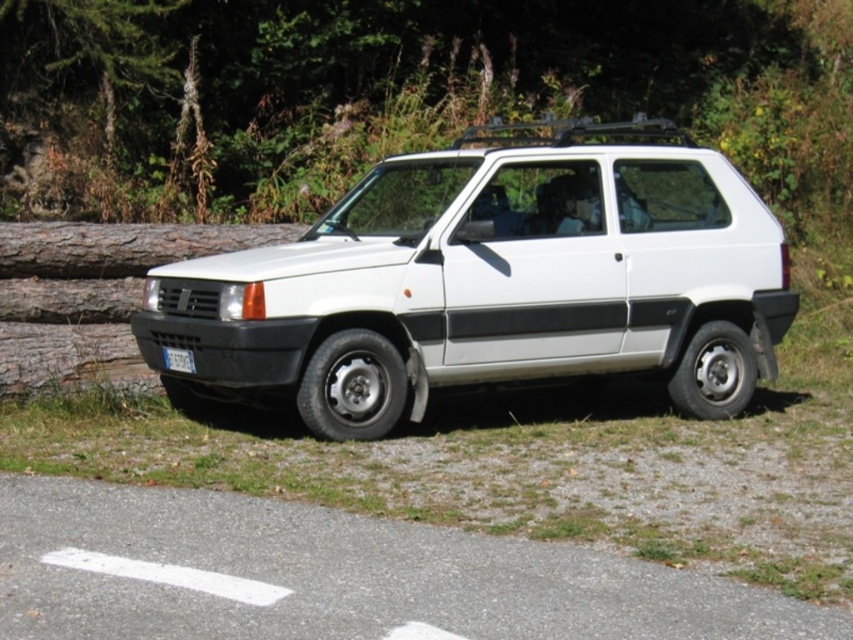
Question: Is white matte suv at center to the left of white plastic license plate at lower left from the viewer's perspective?

Choices:
 (A) no
 (B) yes

Answer: (A)

Question: Is white matte suv at center to the left of white plastic license plate at lower left from the viewer's perspective?

Choices:
 (A) no
 (B) yes

Answer: (A)

Question: Where is white matte suv at center located in relation to white plastic license plate at lower left in the image?

Choices:
 (A) below
 (B) above

Answer: (B)

Question: Among these objects, which one is nearest to the camera?

Choices:
 (A) white matte suv at center
 (B) white plastic license plate at lower left

Answer: (A)

Question: Among these points, which one is nearest to the camera?

Choices:
 (A) (165, 348)
 (B) (299, 300)

Answer: (B)